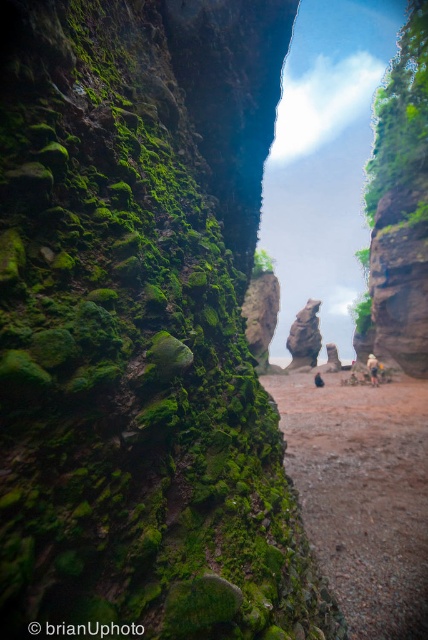
Question: Can you confirm if green mossy rock at upper right is positioned to the left of camouflage fabric backpack at center?

Choices:
 (A) no
 (B) yes

Answer: (A)

Question: Among these objects, which one is nearest to the camera?

Choices:
 (A) green mossy rock at upper right
 (B) camouflage fabric backpack at center

Answer: (A)

Question: Which object appears closest to the camera in this image?

Choices:
 (A) rusty stone rock at center
 (B) brown gravel path at center
 (C) blue fabric person at center
 (D) camouflage fabric backpack at center

Answer: (B)

Question: Among these points, which one is nearest to the camera?

Choices:
 (A) (291, 332)
 (B) (332, 564)

Answer: (B)

Question: Observing the image, what is the correct spatial positioning of green mossy rock at upper right in reference to camouflage fabric backpack at center?

Choices:
 (A) below
 (B) above

Answer: (B)

Question: Does brown gravel path at center appear on the right side of rusty stone rock at center?

Choices:
 (A) yes
 (B) no

Answer: (B)